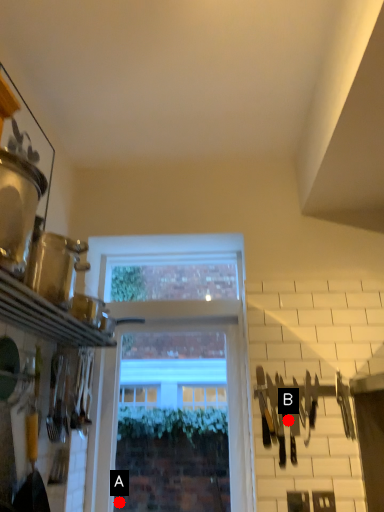
Question: Two points are circled on the image, labeled by A and B beside each circle. Which point is further to the camera?

Choices:
 (A) A is further
 (B) B is further

Answer: (A)